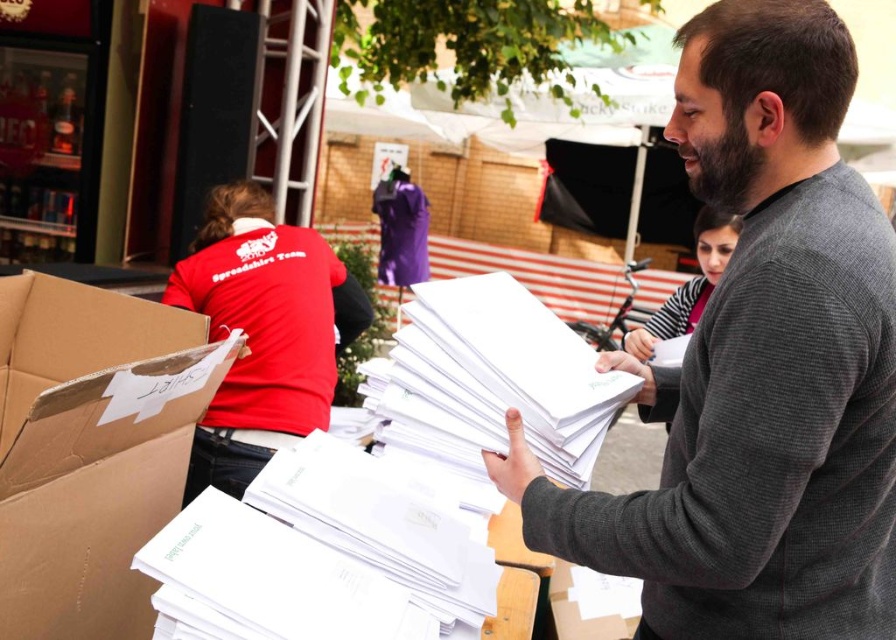
Question: Does gray wool sweater at center appear on the left side of brown cardboard box at lower left?

Choices:
 (A) no
 (B) yes

Answer: (A)

Question: Can you confirm if brown cardboard box at lower left is positioned above dark brown thick beard at center?

Choices:
 (A) no
 (B) yes

Answer: (A)

Question: Which point is closer to the camera taking this photo?

Choices:
 (A) pyautogui.click(x=842, y=557)
 (B) pyautogui.click(x=730, y=156)

Answer: (A)

Question: Can you confirm if brown cardboard box at lower left is smaller than dark brown thick beard at center?

Choices:
 (A) no
 (B) yes

Answer: (A)

Question: Among these objects, which one is nearest to the camera?

Choices:
 (A) gray wool sweater at center
 (B) dark brown thick beard at center
 (C) brown cardboard box at lower left

Answer: (C)

Question: Which point is closer to the camera taking this photo?

Choices:
 (A) (892, 285)
 (B) (52, 372)
 (C) (691, 173)

Answer: (A)